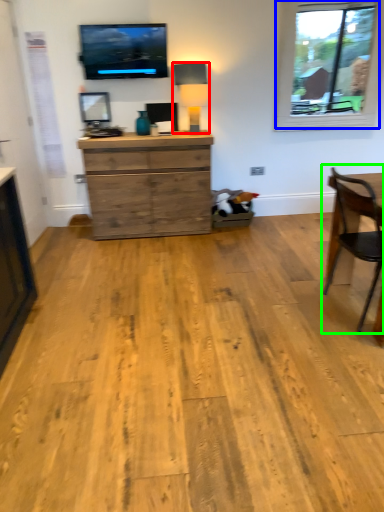
Question: Based on their relative distances, which object is nearer to lamp (highlighted by a red box)? Choose from window (highlighted by a blue box) and chair (highlighted by a green box).

Choices:
 (A) window
 (B) chair

Answer: (A)